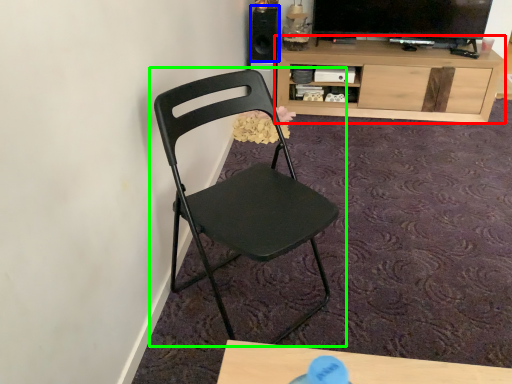
Question: Based on their relative distances, which object is nearer to cabinetry (highlighted by a red box)? Choose from speaker (highlighted by a blue box) and chair (highlighted by a green box).

Choices:
 (A) speaker
 (B) chair

Answer: (A)